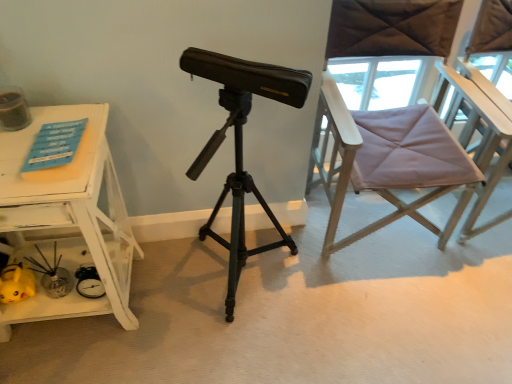
Locate an element on the screen. spots to the right of white painted wood table at left is located at coordinates (174, 311).